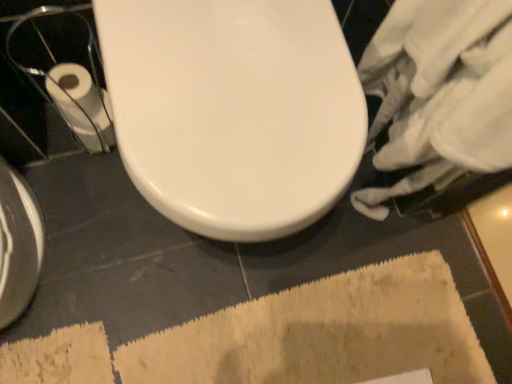
Question: From the image's perspective, is beige textured bath mat at lower center positioned above or below white glossy toilet at center?

Choices:
 (A) below
 (B) above

Answer: (A)

Question: In terms of height, does beige textured bath mat at lower center look taller or shorter compared to white glossy toilet at center?

Choices:
 (A) short
 (B) tall

Answer: (A)

Question: Estimate the real-world distances between objects in this image. Which object is closer to the beige textured bath mat at lower center?

Choices:
 (A) white glossy toilet at center
 (B) white paper at left

Answer: (A)

Question: Estimate the real-world distances between objects in this image. Which object is closer to the beige textured bath mat at lower center?

Choices:
 (A) white paper at left
 (B) white glossy toilet at center

Answer: (B)